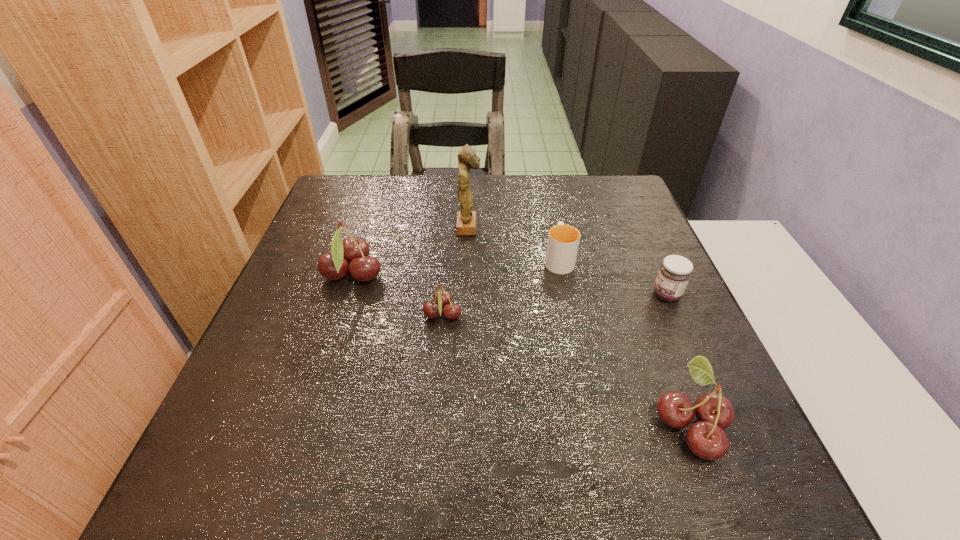
This screenshot has height=540, width=960. What are the coordinates of `object that is at the far edge` in the screenshot? It's located at (467, 159).

Identify the location of object that is at the near edge. This screenshot has width=960, height=540. (706, 438).

The image size is (960, 540). What are the coordinates of `object at the left edge` in the screenshot? It's located at (334, 266).

Find the location of a particular element. This screenshot has height=540, width=960. cherry at the right edge is located at coordinates (706, 438).

This screenshot has width=960, height=540. I want to click on jam present at the right edge, so click(x=674, y=274).

Image resolution: width=960 pixels, height=540 pixels. I want to click on object that is at the near right corner, so click(x=706, y=438).

Locate an element on the screen. Image resolution: width=960 pixels, height=540 pixels. vacant region at the far edge is located at coordinates (499, 196).

Identify the location of vacant space at the near edge of the desktop. The image size is (960, 540). (451, 438).

Identify the location of vacant area at the left edge. (301, 295).

This screenshot has width=960, height=540. Identify the location of vacant region at the right edge of the desktop. (624, 294).